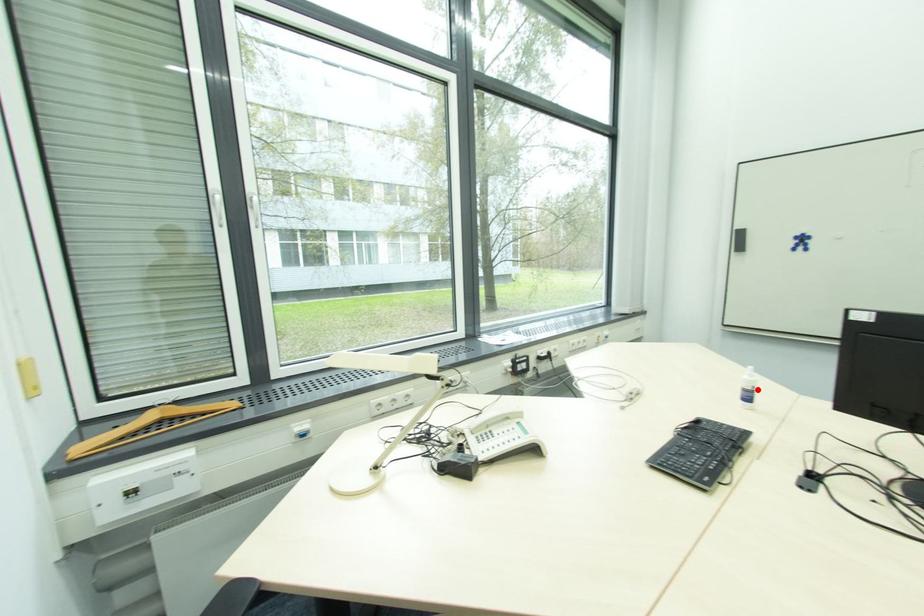
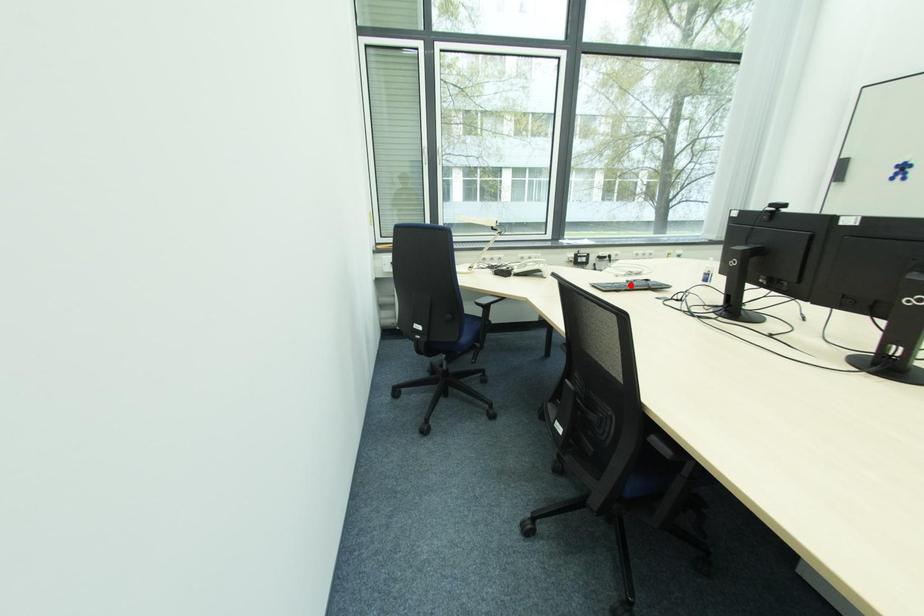
I am providing you with two images of the same scene from different viewpoints. A red point is marked on the first image and another point is marked on the second image. Is the red point in image1 aligned with the point shown in image2?

No